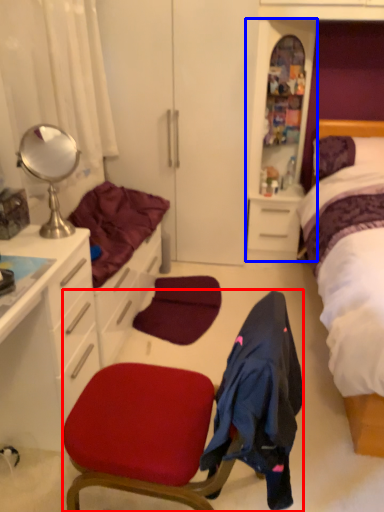
Question: Among these objects, which one is farthest to the camera, chair (highlighted by a red box) or file cabinet (highlighted by a blue box)?

Choices:
 (A) chair
 (B) file cabinet

Answer: (B)